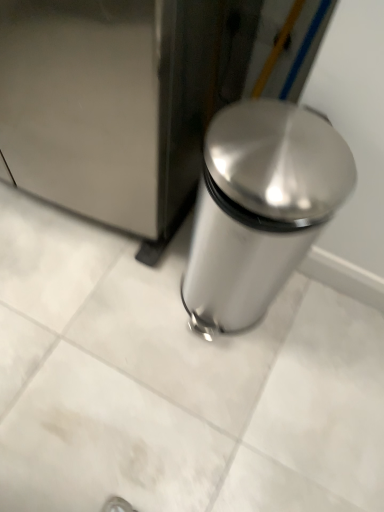
This screenshot has width=384, height=512. What do you see at coordinates (118, 100) in the screenshot?
I see `satin silver trash can at right` at bounding box center [118, 100].

This screenshot has width=384, height=512. I want to click on satin silver trash can at right, so pyautogui.click(x=118, y=100).

Locate an element on the screen. The width and height of the screenshot is (384, 512). satin silver trash can at center is located at coordinates (260, 206).

The width and height of the screenshot is (384, 512). What do you see at coordinates (260, 206) in the screenshot? I see `satin silver trash can at center` at bounding box center [260, 206].

At what (x,y) coordinates should I click in order to perform the action: click on satin silver trash can at right. Please return your answer as a coordinate pair (x, y). Looking at the image, I should click on (118, 100).

Which object is positioned more to the left, satin silver trash can at right or satin silver trash can at center?

satin silver trash can at right is more to the left.

Which object is more forward, satin silver trash can at right or satin silver trash can at center?

satin silver trash can at right is in front.

Is point (120, 157) positioned behind point (278, 159)?

Yes, it is behind point (278, 159).

Looking at this image, from the image's perspective, which one is positioned higher, satin silver trash can at right or satin silver trash can at center?

satin silver trash can at right, from the image's perspective.

From a real-world perspective, is satin silver trash can at right under satin silver trash can at center?

Incorrect, from a real-world perspective, satin silver trash can at right is higher than satin silver trash can at center.

Is satin silver trash can at right wider or thinner than satin silver trash can at center?

Clearly, satin silver trash can at right has more width compared to satin silver trash can at center.

Between satin silver trash can at right and satin silver trash can at center, which one has less height?

satin silver trash can at center.

Does satin silver trash can at right have a smaller size compared to satin silver trash can at center?

No, satin silver trash can at right is not smaller than satin silver trash can at center.

Based on the photo, choose the correct answer: Is satin silver trash can at right inside satin silver trash can at center or outside it?

satin silver trash can at right lies outside satin silver trash can at center.

Are satin silver trash can at right and satin silver trash can at center making contact?

No, satin silver trash can at right is not in contact with satin silver trash can at center.

Is satin silver trash can at right facing towards satin silver trash can at center?

No, satin silver trash can at right is not aimed at satin silver trash can at center.

Measure the distance from satin silver trash can at right to satin silver trash can at center.

They are 13.37 inches apart.

Where is `waste container that is below the satin silver trash can at right (from the image's perspective)`? This screenshot has width=384, height=512. waste container that is below the satin silver trash can at right (from the image's perspective) is located at coordinates (260, 206).

Does satin silver trash can at center appear on the right side of satin silver trash can at right?

Yes, satin silver trash can at center is to the right of satin silver trash can at right.

Which object is further away from the camera taking this photo, satin silver trash can at center or satin silver trash can at right?

satin silver trash can at center is more distant.

Does point (222, 167) lie behind point (14, 140)?

No, (222, 167) is in front of (14, 140).

From the image's perspective, relative to satin silver trash can at right, is satin silver trash can at center above or below?

Clearly, from the image's perspective, satin silver trash can at center is below satin silver trash can at right.

From a real-world perspective, is satin silver trash can at center positioned under satin silver trash can at right based on gravity?

Yes.

In terms of width, does satin silver trash can at center look wider or thinner when compared to satin silver trash can at right?

Clearly, satin silver trash can at center has less width compared to satin silver trash can at right.

Is satin silver trash can at center taller than satin silver trash can at right?

Incorrect, the height of satin silver trash can at center is not larger of that of satin silver trash can at right.

Looking at the image, does satin silver trash can at center seem bigger or smaller compared to satin silver trash can at right?

Clearly, satin silver trash can at center is smaller in size than satin silver trash can at right.

Is satin silver trash can at center not inside satin silver trash can at right?

satin silver trash can at center lies outside satin silver trash can at right's area.

Is satin silver trash can at center far away from satin silver trash can at right?

satin silver trash can at center is near satin silver trash can at right, not far away.

Is satin silver trash can at center facing away from satin silver trash can at right?

No, satin silver trash can at center is not facing away from satin silver trash can at right.

Can you tell me how much satin silver trash can at center and satin silver trash can at right differ in facing direction?

The facing directions of satin silver trash can at center and satin silver trash can at right are 0.00041 degrees apart.

Where is `appliance above the satin silver trash can at center (from a real-world perspective)`? This screenshot has width=384, height=512. appliance above the satin silver trash can at center (from a real-world perspective) is located at coordinates (118, 100).

You are a GUI agent. You are given a task and a screenshot of the screen. Output one action in this format:
    pyautogui.click(x=<x>, y=<y>)
    Task: Click on the waste container lying behind the satin silver trash can at right
    
    Given the screenshot: What is the action you would take?
    pyautogui.click(x=260, y=206)

At what (x,y) coordinates should I click in order to perform the action: click on appliance in front of the satin silver trash can at center. Please return your answer as a coordinate pair (x, y). Image resolution: width=384 pixels, height=512 pixels. Looking at the image, I should click on [118, 100].